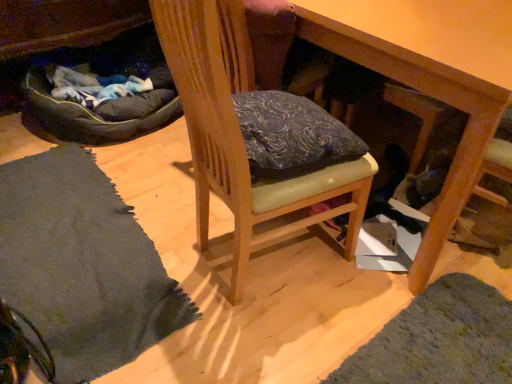
Question: Is wooden chair at center at the back of wooden table at center?

Choices:
 (A) no
 (B) yes

Answer: (A)

Question: Does wooden table at center have a lesser width compared to wooden chair at center?

Choices:
 (A) yes
 (B) no

Answer: (B)

Question: Is wooden table at center shorter than wooden chair at center?

Choices:
 (A) yes
 (B) no

Answer: (A)

Question: Can you confirm if wooden table at center is taller than wooden chair at center?

Choices:
 (A) yes
 (B) no

Answer: (B)

Question: From a real-world perspective, is wooden table at center located higher than wooden chair at center?

Choices:
 (A) no
 (B) yes

Answer: (A)

Question: From the image's perspective, relative to wooden table at center, is wooden chair at center above or below?

Choices:
 (A) above
 (B) below

Answer: (B)

Question: Considering the positions of wooden chair at center and wooden table at center in the image, is wooden chair at center wider or thinner than wooden table at center?

Choices:
 (A) wide
 (B) thin

Answer: (B)

Question: Considering the relative positions of wooden chair at center and wooden table at center in the image provided, is wooden chair at center to the left or to the right of wooden table at center?

Choices:
 (A) left
 (B) right

Answer: (A)

Question: Is point (234, 51) closer or farther from the camera than point (480, 26)?

Choices:
 (A) farther
 (B) closer

Answer: (A)

Question: From the image's perspective, is dark gray fabric bean bag at left positioned above or below soft gray rug at lower left?

Choices:
 (A) above
 (B) below

Answer: (A)

Question: Relative to soft gray rug at lower left, is dark gray fabric bean bag at left in front or behind?

Choices:
 (A) front
 (B) behind

Answer: (B)

Question: Would you say dark gray fabric bean bag at left is to the left or to the right of soft gray rug at lower left in the picture?

Choices:
 (A) left
 (B) right

Answer: (A)

Question: From a real-world perspective, relative to soft gray rug at lower left, is dark gray fabric bean bag at left vertically above or below?

Choices:
 (A) below
 (B) above

Answer: (A)

Question: From the image's perspective, is soft gray rug at lower left above or below wooden table at center?

Choices:
 (A) below
 (B) above

Answer: (A)

Question: Based on their positions, is soft gray rug at lower left located to the left or right of wooden table at center?

Choices:
 (A) left
 (B) right

Answer: (A)